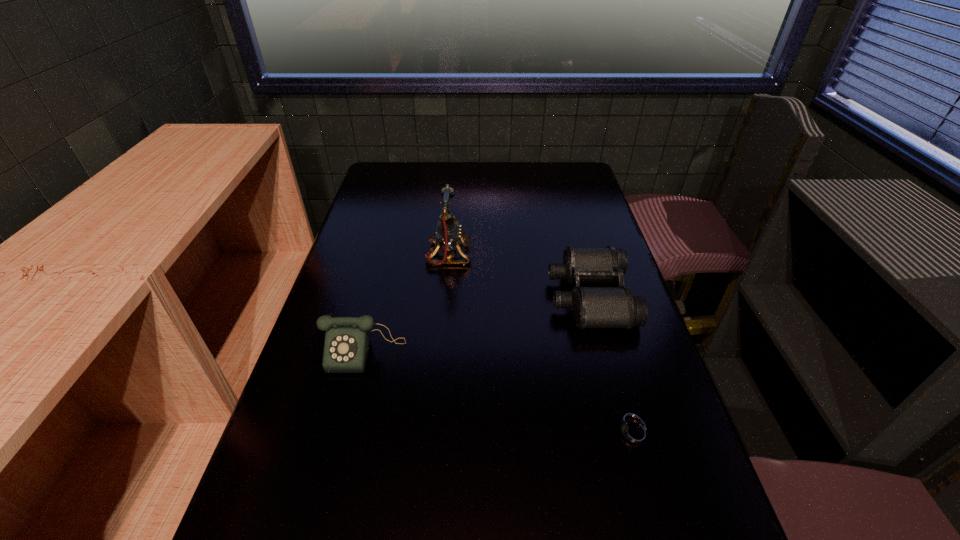
Locate an element on the screen. The height and width of the screenshot is (540, 960). empty location between the shorter telephone and the watch is located at coordinates click(499, 392).

Locate which object ranks in proximity to the binoculars. Please provide its 2D coordinates. Your answer should be formatted as a tuple, i.e. [(x, y)], where the tuple contains the x and y coordinates of a point satisfying the conditions above.

[(634, 434)]

Select which object is the third closest to the binoculars. Please provide its 2D coordinates. Your answer should be formatted as a tuple, i.e. [(x, y)], where the tuple contains the x and y coordinates of a point satisfying the conditions above.

[(347, 344)]

This screenshot has height=540, width=960. Find the location of `vacant space that satisfies the following two spatial constraints: 1. through the eyepieces of the binoculars; 2. on the dial of the shorter telephone`. vacant space that satisfies the following two spatial constraints: 1. through the eyepieces of the binoculars; 2. on the dial of the shorter telephone is located at coordinates (605, 351).

Locate an element on the screen. The height and width of the screenshot is (540, 960). vacant region that satisfies the following two spatial constraints: 1. through the eyepieces of the binoculars; 2. on the dial of the leftmost object is located at coordinates [x=605, y=351].

At what (x,y) coordinates should I click in order to perform the action: click on free point that satisfies the following two spatial constraints: 1. through the eyepieces of the binoculars; 2. on the dial of the left telephone. Please return your answer as a coordinate pair (x, y). Looking at the image, I should click on (605, 351).

Locate an element on the screen. vacant space that satisfies the following two spatial constraints: 1. through the eyepieces of the binoculars; 2. on the dial of the shorter telephone is located at coordinates (605, 351).

The width and height of the screenshot is (960, 540). What are the coordinates of `free spot that satisfies the following two spatial constraints: 1. through the eyepieces of the binoculars; 2. on the dial of the left telephone` in the screenshot? It's located at pos(605,351).

Locate an element on the screen. vacant space that satisfies the following two spatial constraints: 1. through the eyepieces of the binoculars; 2. on the dial of the left telephone is located at coordinates (605, 351).

Locate an element on the screen. Image resolution: width=960 pixels, height=540 pixels. vacant region that satisfies the following two spatial constraints: 1. through the eyepieces of the binoculars; 2. on the dial of the leftmost object is located at coordinates (605, 351).